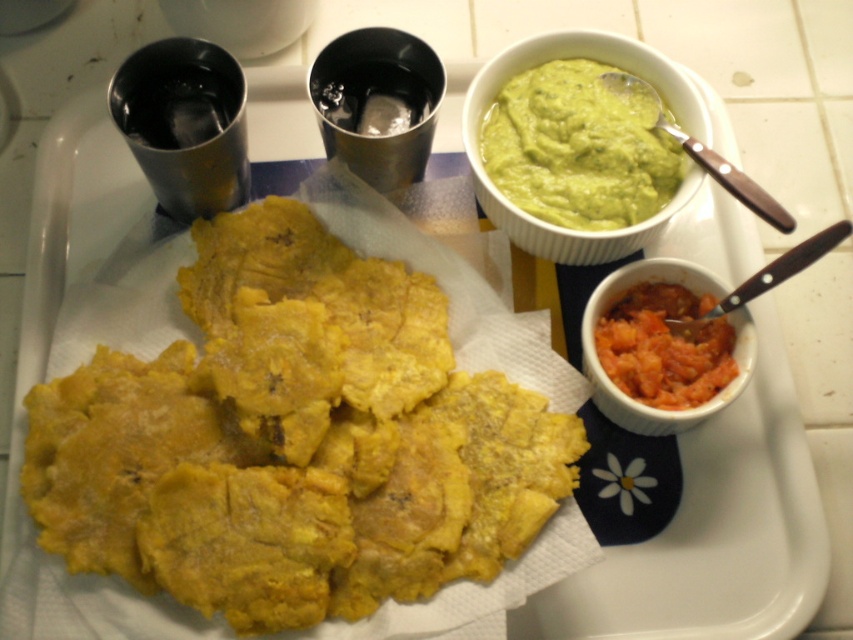
Who is positioned more to the right, yellow fried plantains at center or smooth orange puree at lower right?

Positioned to the right is smooth orange puree at lower right.

Is yellow fried plantains at center positioned in front of smooth orange puree at lower right?

Yes, it is.

Which is behind, point (260, 586) or point (730, 369)?

Point (730, 369)

Identify the location of yellow fried plantains at center. (302, 428).

Is point (161, 385) less distant than point (543, 115)?

Yes, it is.

Image resolution: width=853 pixels, height=640 pixels. Identify the location of yellow fried plantains at center. (302, 428).

Image resolution: width=853 pixels, height=640 pixels. In order to click on yellow fried plantains at center in this screenshot , I will do `click(302, 428)`.

Does green smooth guacamole at upper right have a smaller size compared to smooth orange puree at lower right?

No, green smooth guacamole at upper right is not smaller than smooth orange puree at lower right.

What do you see at coordinates (578, 148) in the screenshot?
I see `green smooth guacamole at upper right` at bounding box center [578, 148].

Who is more distant from viewer, (628, 147) or (653, 387)?

The point (628, 147) is behind.

Locate an element on the screen. green smooth guacamole at upper right is located at coordinates (578, 148).